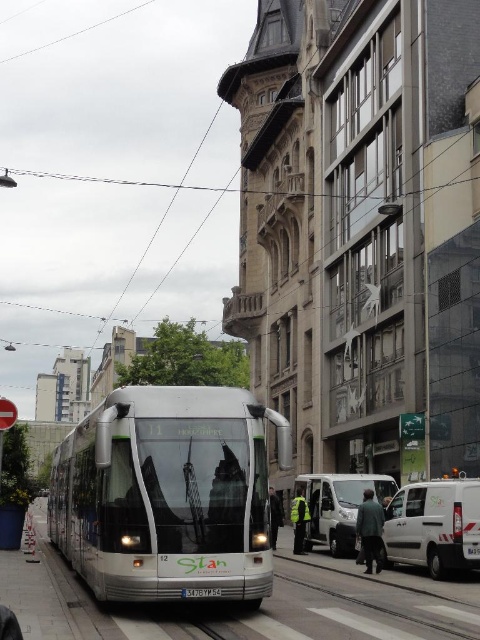
You are a delivery driver who needs to park your truck, which is 9 meters long, between the silver metallic bus at center and the white matte van at lower center. Is there enough space for your truck between them?

The silver metallic bus at center is 8.86 meters from the white matte van at lower center. Since your truck is 9 meters long, there isn t enough space to park it between them.

You are standing on the sidewalk and looking at the tram and the two white vans. There are two points marked in the scene. Which point, point (x=91, y=468) or point (x=382, y=486), is closer to you?

Point (x=91, y=468) is closer to you than point (x=382, y=486).

You are standing on the sidewalk next to the tram tracks. You want to cross the street to reach the silver metallic bus at center. The tram is currently 10 meters long. If the tram is parked on the tracks, will it block your path to the bus?

The silver metallic bus at center is 14.86 meters away from you. The tram is 10 meters long, so it will not block your path to the bus since it is shorter than the distance between you and the bus.